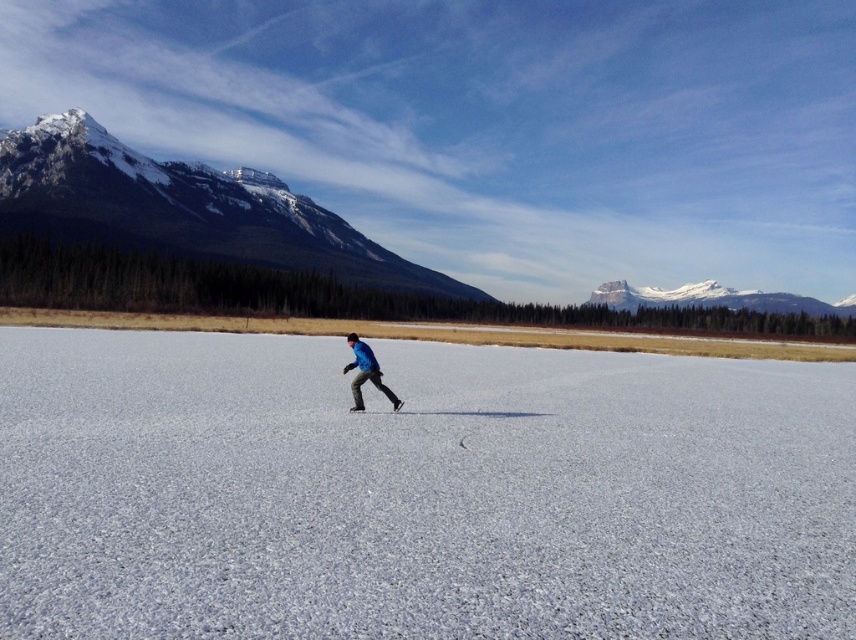
Question: Can you confirm if white ice at center is thinner than snowy granite mountain at upper left?

Choices:
 (A) yes
 (B) no

Answer: (A)

Question: Is snowy granite mountain at upper left in front of black matte ski at center?

Choices:
 (A) no
 (B) yes

Answer: (A)

Question: Which of the following is the closest to the observer?

Choices:
 (A) (75, 156)
 (B) (397, 400)
 (C) (610, 579)
 (D) (711, 291)

Answer: (C)

Question: Which of the following is the farthest from the observer?

Choices:
 (A) white ice at center
 (B) snowy granite mountain at upper center
 (C) snowy granite mountain at upper left

Answer: (B)

Question: Based on their relative distances, which object is farther from the black matte ski at center?

Choices:
 (A) snowy granite mountain at upper center
 (B) white ice at center
 (C) snowy granite mountain at upper left

Answer: (A)

Question: Does white ice at center have a smaller size compared to snowy granite mountain at upper left?

Choices:
 (A) no
 (B) yes

Answer: (B)